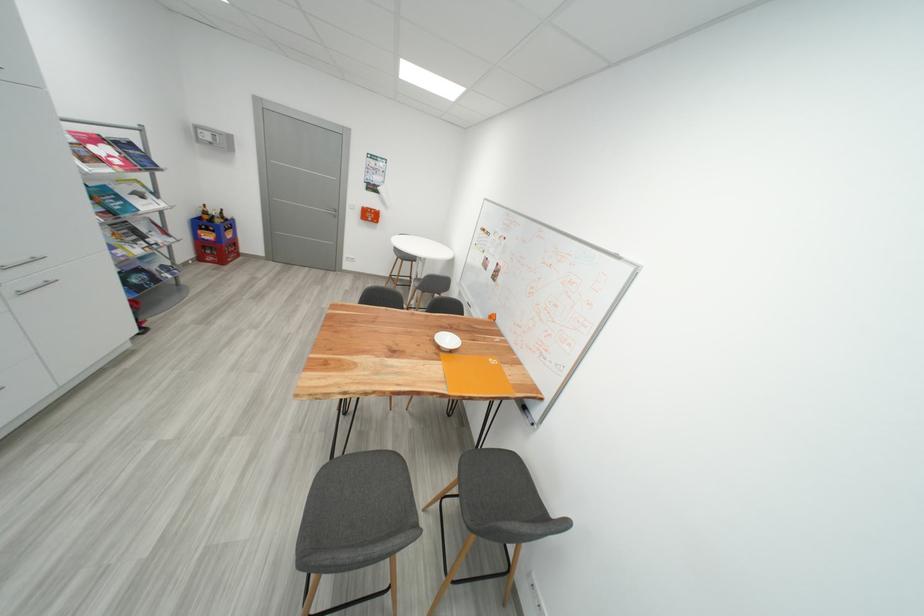
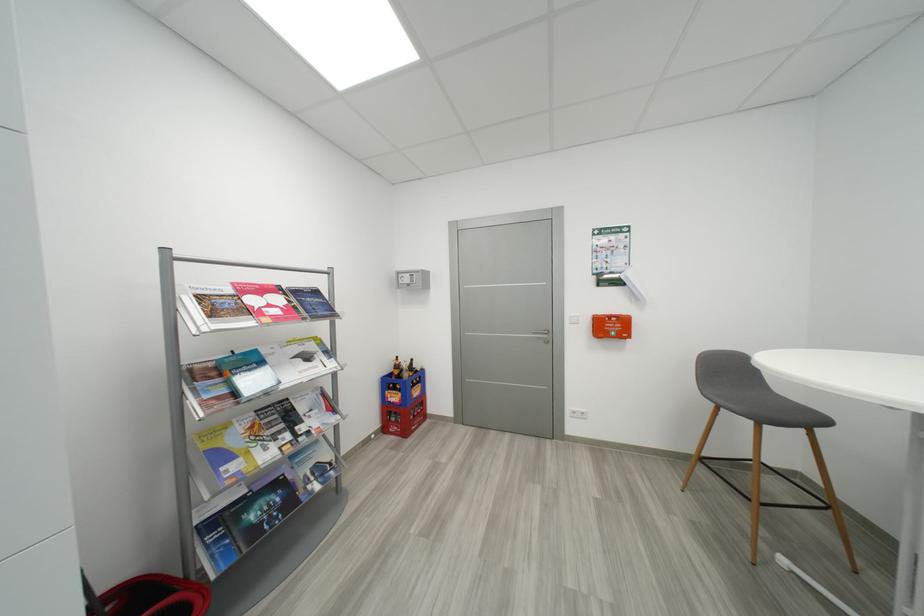
In the second image, find the point that corresponds to pixel 150 245 in the first image.

(294, 438)